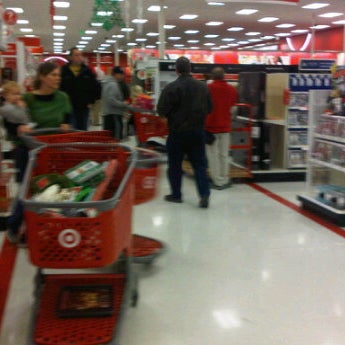
At what (x,y) coordinates should I click in order to perform the action: click on in-store signage. Please return your answer as a coordinate pair (x, y). Looking at the image, I should click on (248, 57).